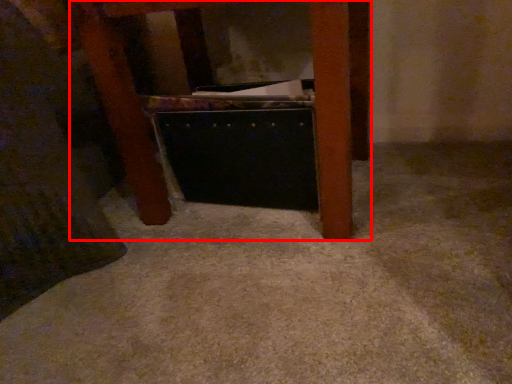
Question: From the image's perspective, where is furniture (annotated by the red box) located in relation to drawer in the image?

Choices:
 (A) below
 (B) above

Answer: (B)